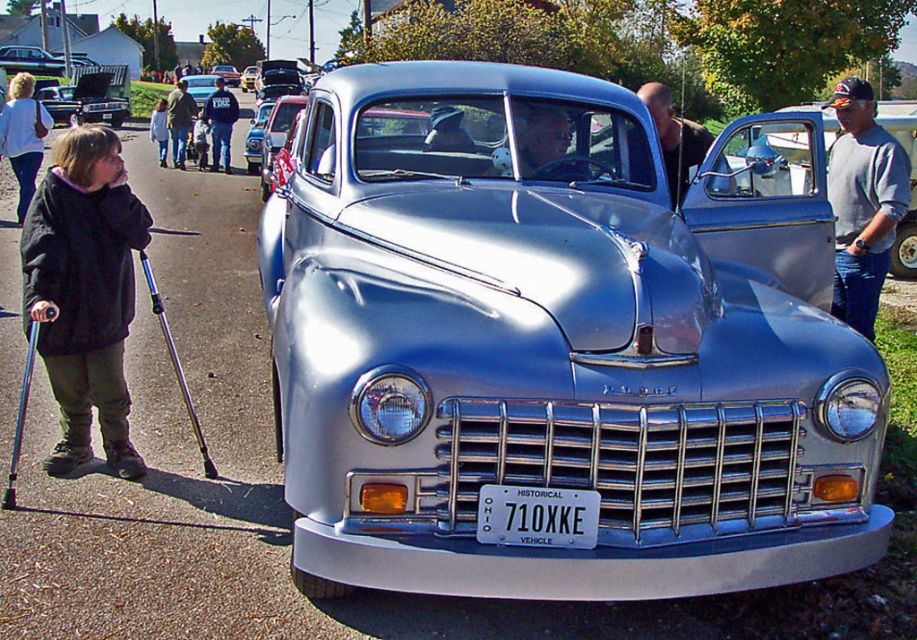
Question: Which point is closer to the camera taking this photo?

Choices:
 (A) (23, 177)
 (B) (902, 156)

Answer: (B)

Question: Is gray sweater at right further to the viewer compared to white cotton jacket at left?

Choices:
 (A) no
 (B) yes

Answer: (A)

Question: Does black fleece jacket at left have a lesser width compared to white plastic license plate at center?

Choices:
 (A) yes
 (B) no

Answer: (B)

Question: Can you confirm if white plastic license plate at center is wider than smooth silver car at center?

Choices:
 (A) no
 (B) yes

Answer: (A)

Question: Estimate the real-world distances between objects in this image. Which object is closer to the gray sweater at right?

Choices:
 (A) smooth silver car at center
 (B) dark blue jeans at center

Answer: (A)

Question: Which object is farther from the camera taking this photo?

Choices:
 (A) white plastic license plate at center
 (B) black fleece jacket at left
 (C) dark blue jeans at center
 (D) shiny metallic car at center

Answer: (C)